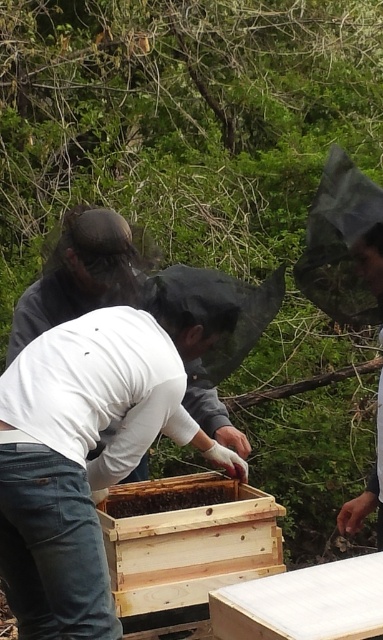
Does wooden beehive at center appear over brown wooden beehive at center?

No, wooden beehive at center is not above brown wooden beehive at center.

Does wooden beehive at center lie behind brown wooden beehive at center?

No.

Is point (276, 561) less distant than point (160, 492)?

Yes, point (276, 561) is closer to viewer.

Identify the location of wooden beehive at center. The width and height of the screenshot is (383, 640). (186, 540).

Can you confirm if wooden beehive at center is bigger than white matte shirt at center?

Actually, wooden beehive at center might be smaller than white matte shirt at center.

Between wooden beehive at center and white matte shirt at center, which one is positioned higher?

white matte shirt at center is above.

You are a GUI agent. You are given a task and a screenshot of the screen. Output one action in this format:
    pyautogui.click(x=<x>, y=<y>)
    Task: Click on the wooden beehive at center
    This screenshot has width=383, height=640.
    Given the screenshot: What is the action you would take?
    pyautogui.click(x=186, y=540)

Can you confirm if white matte shirt at center is wider than brown wooden beehive at center?

Indeed, white matte shirt at center has a greater width compared to brown wooden beehive at center.

Identify the location of white matte shirt at center. This screenshot has height=640, width=383. (78, 275).

Between point (57, 243) and point (230, 490), which one is positioned behind?

Point (57, 243)

The height and width of the screenshot is (640, 383). What are the coordinates of `white matte shirt at center` in the screenshot? It's located at (78, 275).